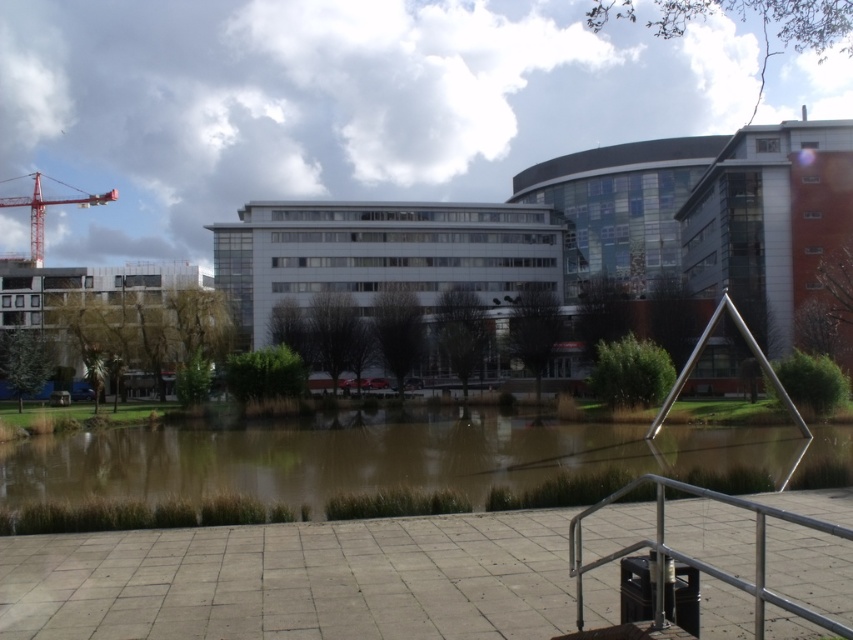
Is brown muddy water at center positioned in front of red metal crane at upper left?

Yes, it is.

Who is taller, brown muddy water at center or red metal crane at upper left?

red metal crane at upper left is taller.

Where is `brown muddy water at center`? The image size is (853, 640). brown muddy water at center is located at coordinates (370, 456).

I want to click on brown muddy water at center, so click(x=370, y=456).

Does silver metallic rail at lower right appear under red metal crane at upper left?

Correct, silver metallic rail at lower right is located below red metal crane at upper left.

Does silver metallic rail at lower right come in front of red metal crane at upper left?

That is True.

At what (x,y) coordinates should I click in order to perform the action: click on silver metallic rail at lower right. Please return your answer as a coordinate pair (x, y). Looking at the image, I should click on (699, 560).

Does point (318, 468) come behind point (575, 579)?

Yes, it is.

From the picture: Does brown muddy water at center appear under silver metallic rail at lower right?

Indeed, brown muddy water at center is positioned under silver metallic rail at lower right.

Is point (308, 472) less distant than point (759, 566)?

No, it is not.

Identify the location of brown muddy water at center. This screenshot has width=853, height=640. (370, 456).